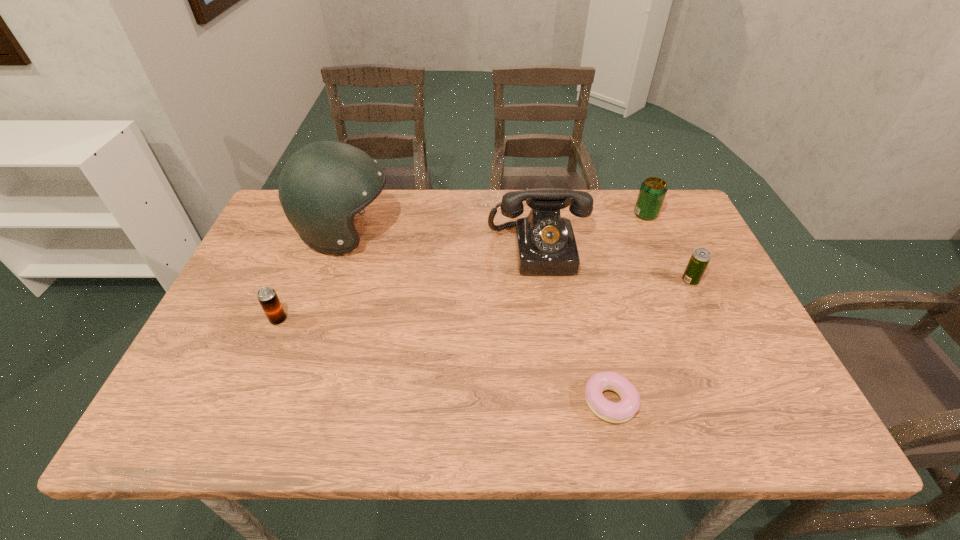
You are a GUI agent. You are given a task and a screenshot of the screen. Output one action in this format:
    pyautogui.click(x=<x>, y=<y>)
    Task: Click on the blank region between the nearest object and the farthest beer can
    
    Given the screenshot: What is the action you would take?
    pyautogui.click(x=628, y=308)

Image resolution: width=960 pixels, height=540 pixels. I want to click on vacant point located between the shortest object and the farthest beer can, so click(x=628, y=308).

Locate an element on the screen. The height and width of the screenshot is (540, 960). vacant space in between the fifth shortest object and the football helmet is located at coordinates (442, 241).

This screenshot has width=960, height=540. Find the location of `vacant area between the tallest object and the second tallest object`. vacant area between the tallest object and the second tallest object is located at coordinates (442, 241).

Identify the location of free space between the second nearest object and the second farthest beer can. The width and height of the screenshot is (960, 540). (484, 300).

At what (x,y) coordinates should I click in order to perform the action: click on free space between the farthest beer can and the second nearest beer can. Please return your answer as a coordinate pair (x, y). The height and width of the screenshot is (540, 960). Looking at the image, I should click on (668, 247).

Where is `object that can be found as the closest to the nearest beer can`? This screenshot has width=960, height=540. object that can be found as the closest to the nearest beer can is located at coordinates (323, 185).

Where is `the third closest object relative to the doughnut`? This screenshot has height=540, width=960. the third closest object relative to the doughnut is located at coordinates (653, 190).

Identify the location of the closest beer can to the fifth farthest object. This screenshot has width=960, height=540. [x=699, y=260].

Identify which beer can is located as the nearest to the fifth farthest object. Please provide its 2D coordinates. Your answer should be formatted as a tuple, i.e. [(x, y)], where the tuple contains the x and y coordinates of a point satisfying the conditions above.

[(699, 260)]